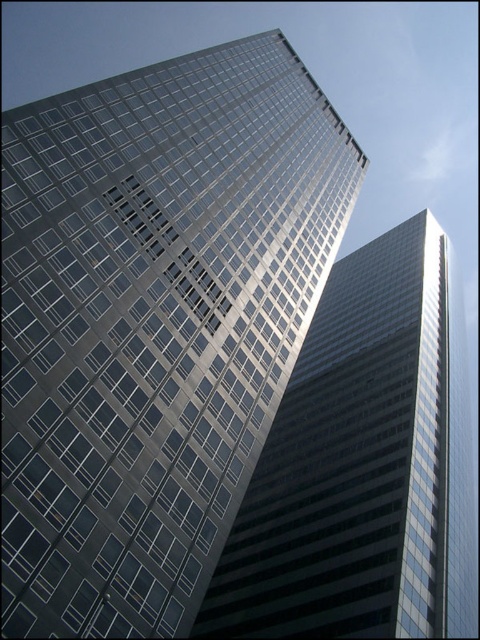
What do you see at coordinates (154, 323) in the screenshot? This screenshot has height=640, width=480. I see `glossy glass building at center` at bounding box center [154, 323].

Find the location of `glossy glass building at center`. glossy glass building at center is located at coordinates point(154,323).